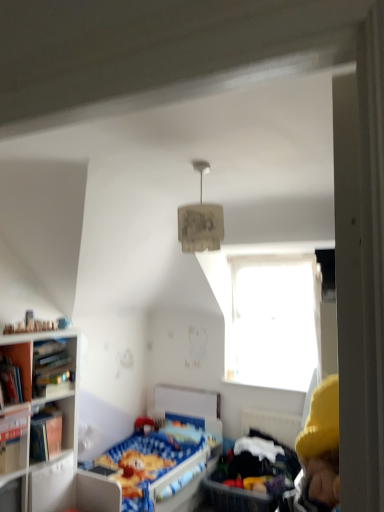
Question: Looking at the image, does transparent glass window at upper center seem bigger or smaller compared to blue fabric infant bed at lower right?

Choices:
 (A) big
 (B) small

Answer: (B)

Question: Is transparent glass window at upper center taller or shorter than blue fabric infant bed at lower right?

Choices:
 (A) short
 (B) tall

Answer: (B)

Question: Considering the real-world distances, which object is farthest from the transparent glass window at upper center?

Choices:
 (A) hardcover book at left, placed as the second book when sorted from top to bottom
 (B) wooden bookshelf at left
 (C) wooden bookshelf at left
 (D) hardcover book at left, the 1th book viewed from the top
 (E) blue fabric bed at center

Answer: (D)

Question: Which object is positioned closest to the matte beige lampshade at center?

Choices:
 (A) blue fabric infant bed at lower right
 (B) hardcover book at left, acting as the 2th book starting from the bottom
 (C) wooden bookshelf at left
 (D) wooden bookshelf at left
 (E) transparent glass window at upper center

Answer: (C)